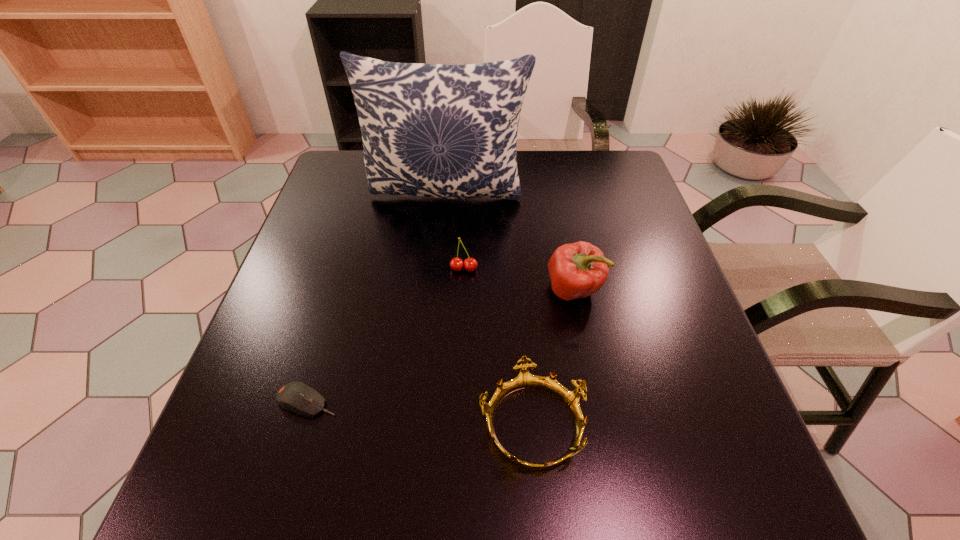
Where is `vacant region at the near left corner of the desktop`? The image size is (960, 540). vacant region at the near left corner of the desktop is located at coordinates (263, 509).

In the image, there is a desktop. What are the coordinates of `free space at the far right corner` in the screenshot? It's located at (597, 156).

At what (x,y) coordinates should I click in order to perform the action: click on vacant area at the near right corner. Please return your answer as a coordinate pair (x, y). Looking at the image, I should click on (658, 471).

The width and height of the screenshot is (960, 540). What are the coordinates of `vacant area between the cherry and the computer mouse` in the screenshot? It's located at (386, 335).

Identify the location of vacant area between the computer mouse and the fourth shortest object. (441, 346).

This screenshot has height=540, width=960. In order to click on empty space between the computer mouse and the third shortest object in this screenshot , I will do `click(386, 335)`.

Locate an element on the screen. This screenshot has width=960, height=540. free space between the computer mouse and the third shortest object is located at coordinates (386, 335).

Find the location of `vacant region between the shortest object and the fourth shortest object`. vacant region between the shortest object and the fourth shortest object is located at coordinates (441, 346).

This screenshot has width=960, height=540. Find the location of `unoccupied position between the cushion and the fourth shortest object`. unoccupied position between the cushion and the fourth shortest object is located at coordinates (510, 244).

This screenshot has width=960, height=540. Identify the location of free space between the bell pepper and the computer mouse. (441, 346).